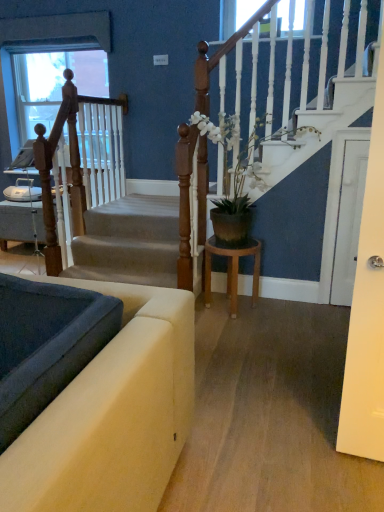
Question: From the image's perspective, is velvet beige sofa at lower left below white glossy door at right?

Choices:
 (A) no
 (B) yes

Answer: (B)

Question: Is velvet beige sofa at lower left outside of white glossy door at right?

Choices:
 (A) no
 (B) yes

Answer: (B)

Question: Does velvet beige sofa at lower left appear on the right side of white glossy door at right?

Choices:
 (A) no
 (B) yes

Answer: (A)

Question: Can you confirm if velvet beige sofa at lower left is smaller than white glossy door at right?

Choices:
 (A) no
 (B) yes

Answer: (A)

Question: Is white glossy door at right inside velvet beige sofa at lower left?

Choices:
 (A) yes
 (B) no

Answer: (B)

Question: Based on their positions, is velvet beige sofa at lower left located to the left or right of wooden stool at center?

Choices:
 (A) right
 (B) left

Answer: (B)

Question: Considering their positions, is velvet beige sofa at lower left located in front of or behind wooden stool at center?

Choices:
 (A) front
 (B) behind

Answer: (A)

Question: Looking at their shapes, would you say velvet beige sofa at lower left is wider or thinner than wooden stool at center?

Choices:
 (A) wide
 (B) thin

Answer: (B)

Question: Would you say velvet beige sofa at lower left is inside or outside wooden stool at center?

Choices:
 (A) outside
 (B) inside

Answer: (A)

Question: Is smooth gray carpet at lower left in front of or behind velvet beige sofa at lower left in the image?

Choices:
 (A) behind
 (B) front

Answer: (A)

Question: In terms of width, does smooth gray carpet at lower left look wider or thinner when compared to velvet beige sofa at lower left?

Choices:
 (A) thin
 (B) wide

Answer: (A)

Question: In the image, is smooth gray carpet at lower left on the left side or the right side of velvet beige sofa at lower left?

Choices:
 (A) right
 (B) left

Answer: (B)

Question: Is smooth gray carpet at lower left bigger or smaller than velvet beige sofa at lower left?

Choices:
 (A) small
 (B) big

Answer: (A)

Question: Is point (120, 181) closer or farther from the camera than point (228, 251)?

Choices:
 (A) farther
 (B) closer

Answer: (A)

Question: Is wooden at left inside or outside of wooden stool at center?

Choices:
 (A) inside
 (B) outside

Answer: (B)